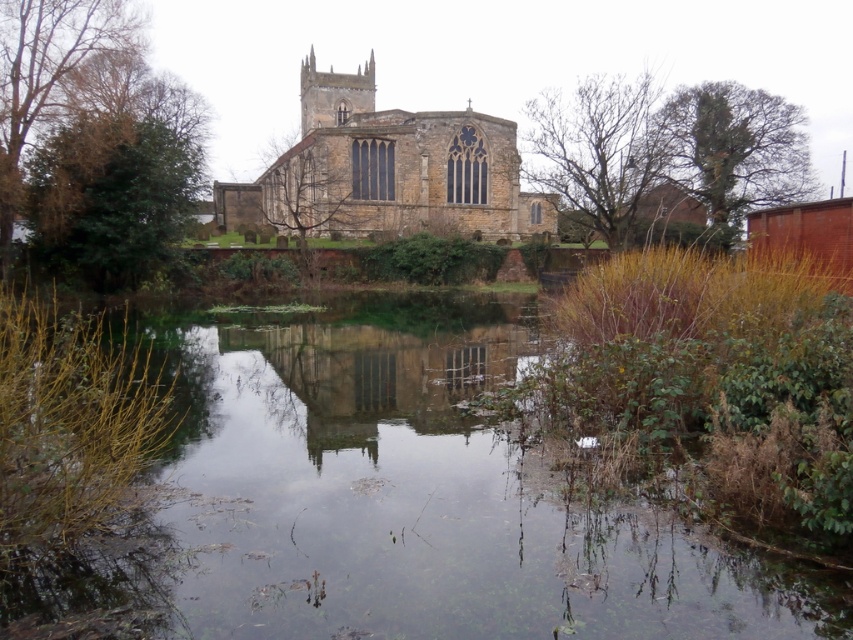
Question: Does clear water at center have a larger size compared to brown stone church at center?

Choices:
 (A) no
 (B) yes

Answer: (A)

Question: Considering the relative positions of bare branches at upper right and green leafy tree at upper right in the image provided, where is bare branches at upper right located with respect to green leafy tree at upper right?

Choices:
 (A) left
 (B) right

Answer: (A)

Question: Which of the following is the closest to the observer?

Choices:
 (A) bare branches at center
 (B) bare branches at upper right
 (C) clear water at center

Answer: (C)

Question: Which point is farther to the camera?

Choices:
 (A) (9, 81)
 (B) (802, 168)

Answer: (B)

Question: Which point is closer to the camera?

Choices:
 (A) clear water at center
 (B) bare branches at upper right
 (C) green leafy tree at left

Answer: (A)

Question: Can you confirm if clear water at center is smaller than brown stone church at center?

Choices:
 (A) yes
 (B) no

Answer: (A)